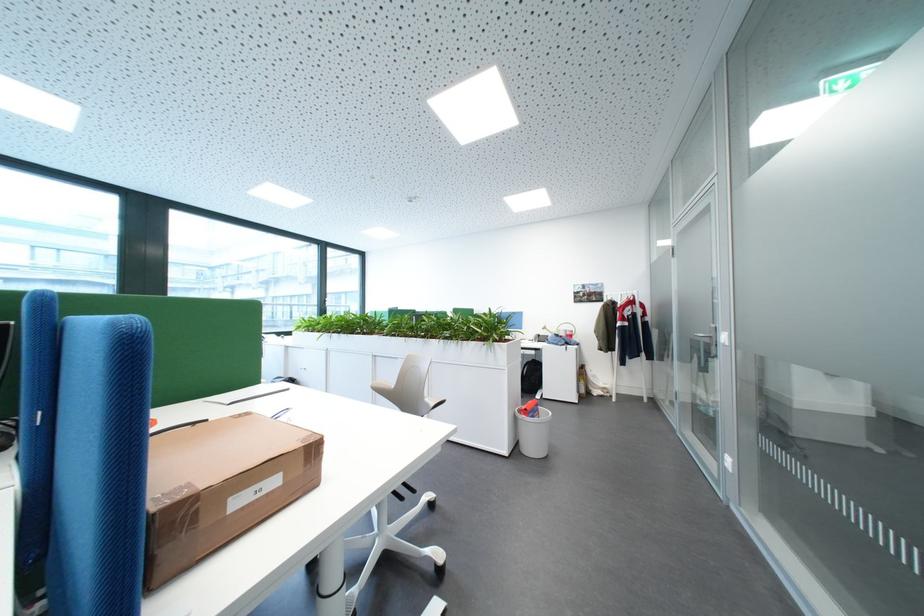
Identify the location of dark cabinet handle. (582, 387).